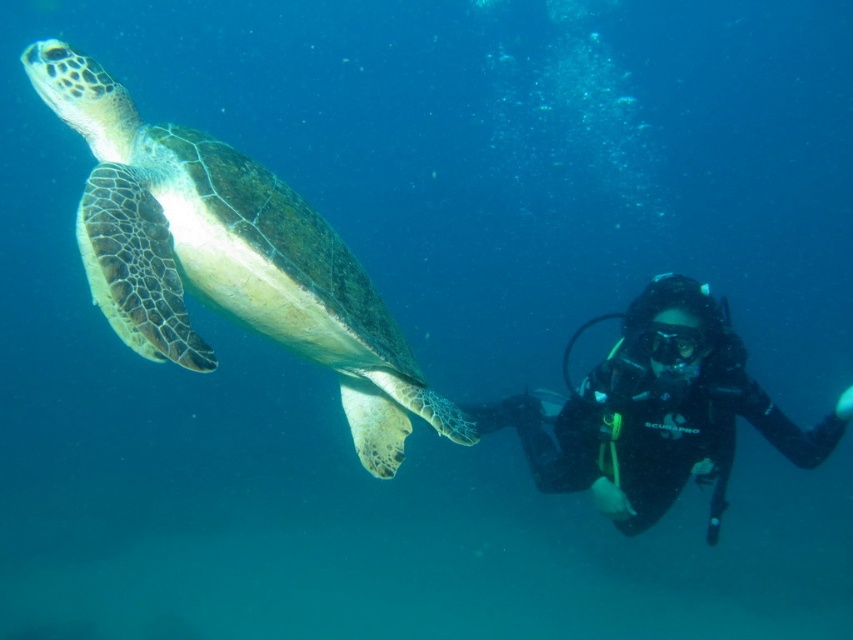
Question: Can you confirm if green textured shell at left is wider than black rubber diving suit at right?

Choices:
 (A) yes
 (B) no

Answer: (B)

Question: Observing the image, what is the correct spatial positioning of green textured shell at left in reference to black rubber diving suit at right?

Choices:
 (A) below
 (B) above

Answer: (B)

Question: Which object appears farthest from the camera in this image?

Choices:
 (A) green textured shell at left
 (B) black rubber diving suit at right

Answer: (B)

Question: Does green textured shell at left appear under black rubber diving suit at right?

Choices:
 (A) no
 (B) yes

Answer: (A)